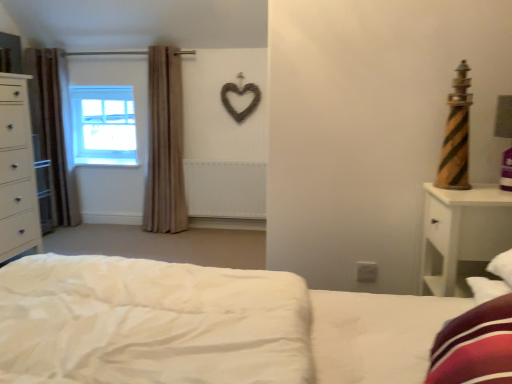
Find the location of a particular element. free space above white wood nightstand at right (from a real-world perspective) is located at coordinates (479, 188).